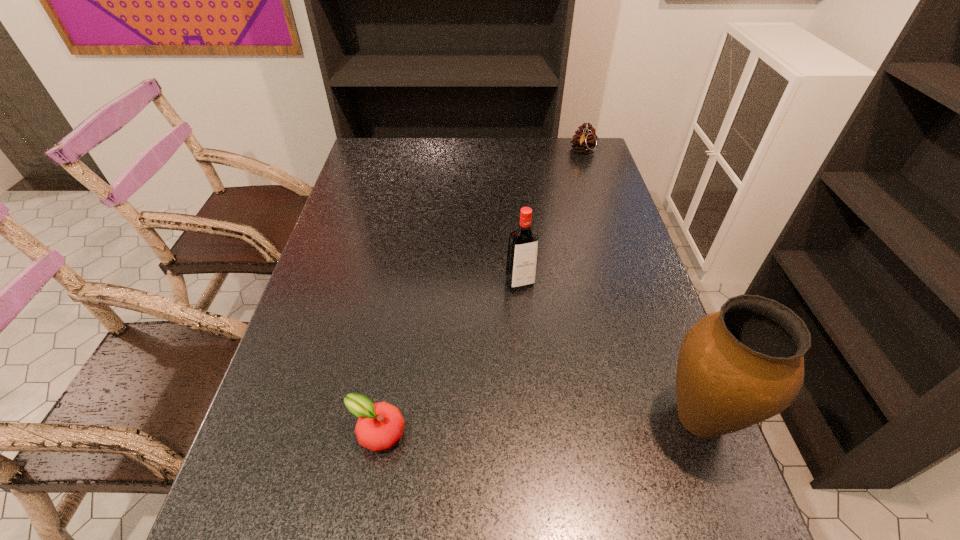
At what (x,y) coordinates should I click in order to perform the action: click on free space between the second farthest object and the apple. Please return your answer as a coordinate pair (x, y). This screenshot has height=540, width=960. Looking at the image, I should click on (448, 359).

Identify the location of free spot between the farthest object and the tallest object. (641, 285).

The width and height of the screenshot is (960, 540). Find the location of `free space between the farthest object and the leftmost object`. free space between the farthest object and the leftmost object is located at coordinates (480, 292).

Locate an element on the screen. The height and width of the screenshot is (540, 960). free area in between the shortest object and the urn is located at coordinates (539, 426).

The width and height of the screenshot is (960, 540). Identify the location of empty location between the tallest object and the second tallest object. (611, 350).

The height and width of the screenshot is (540, 960). Find the location of `free space between the shortest object and the pinecone`. free space between the shortest object and the pinecone is located at coordinates (480, 292).

Where is `vacant region between the vodka and the apple`? vacant region between the vodka and the apple is located at coordinates (448, 359).

Identify the location of free space that is in between the farthest object and the leftmost object. This screenshot has height=540, width=960. (480, 292).

In order to click on vacant area that lies between the urn and the second tallest object in this screenshot , I will do `click(611, 350)`.

Select which object appears as the closest to the second tallest object. Please provide its 2D coordinates. Your answer should be formatted as a tuple, i.e. [(x, y)], where the tuple contains the x and y coordinates of a point satisfying the conditions above.

[(744, 364)]